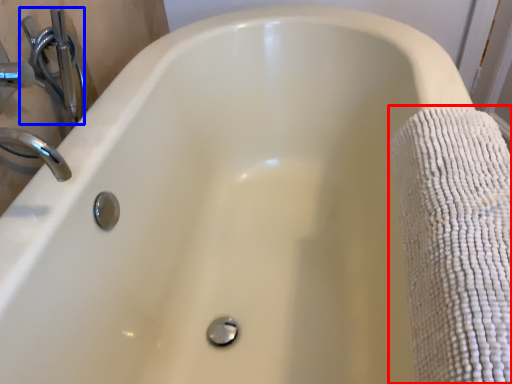
Question: Which object appears farthest to the camera in this image, bath towel (highlighted by a red box) or plumbing fixture (highlighted by a blue box)?

Choices:
 (A) bath towel
 (B) plumbing fixture

Answer: (B)